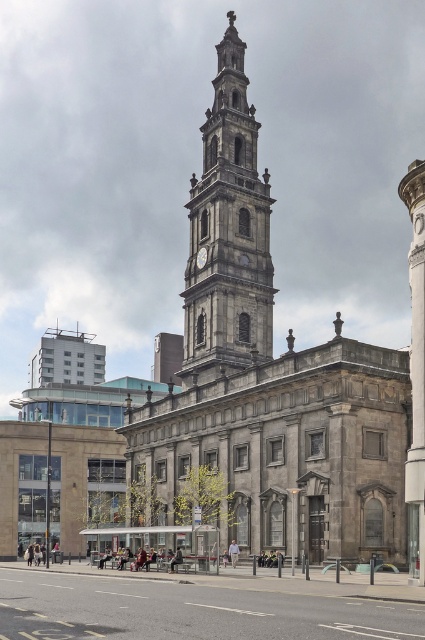
You are standing in front of the historic stone church. You notice the stone clock tower at center and the gold metallic clock at center. Which object is located above the other?

The stone clock tower at center is positioned over the gold metallic clock at center, meaning the tower is above the clock.

You are standing on the road with lane markings in front of the gray stone church at center and gold metallic clock at center. Which object is located higher in the image?

The gold metallic clock at center is higher because the gray stone church at center is positioned under it.

You are standing at the point marked by coordinates point (192, 609) in the image. What type of surface are you currently standing on?

The point (192, 609) marks concrete pavement at lower center, so you are standing on concrete pavement.